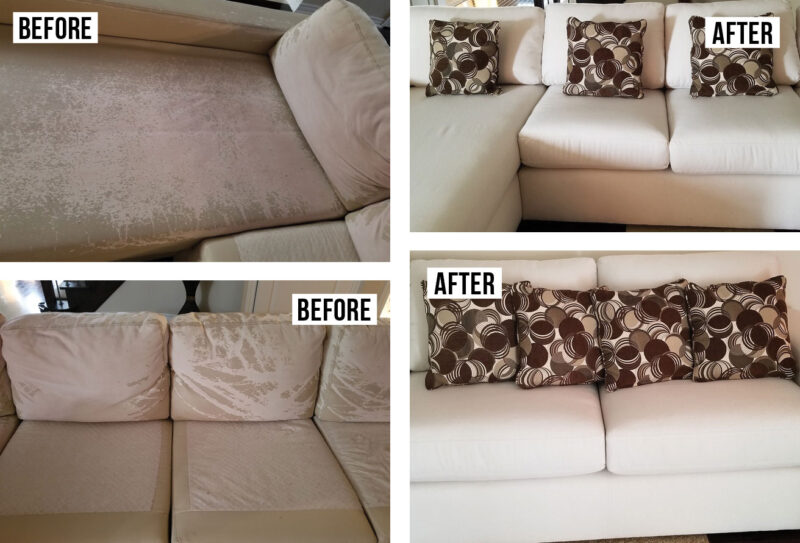
Locate an element on the screen. printed throw pillows is located at coordinates (481, 50), (481, 329), (557, 331), (634, 329), (722, 331), (730, 72), (609, 69).